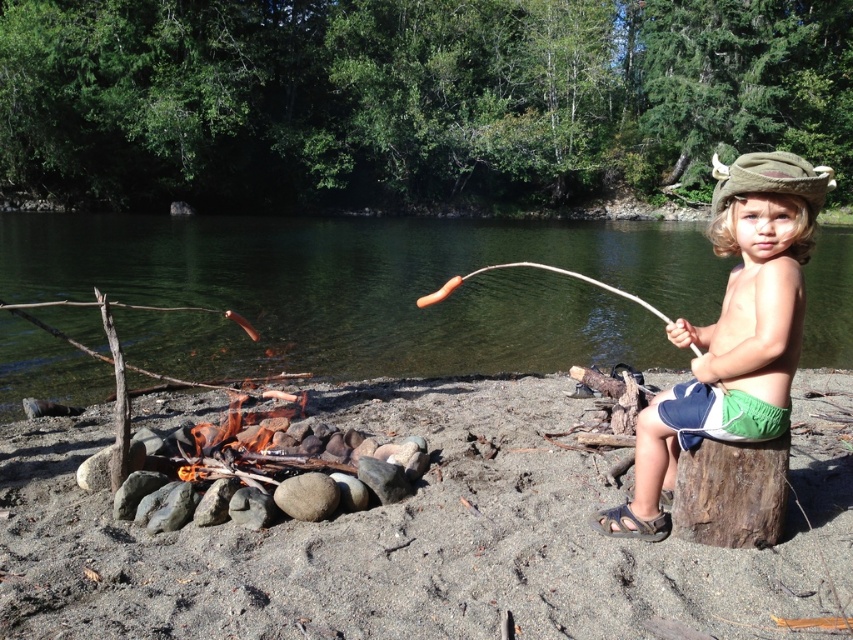
You are standing at the edge of the riverbank and want to reach the brown rough tree trunk at lower right without getting your feet wet. Based on the scene, which direction should you move to avoid stepping into the green water at center?

You should move towards the right side of the image because the brown rough tree trunk at lower right is farther from the viewer compared to the green water at center, so moving right would take you away from the water towards the tree trunk.

Looking at the scene by the riverbank, you notice the green water at center and the green fabric hat at right. Which object is wider?

The green water at center is wider than the green fabric hat at right.

You are standing at the riverbank and want to retrieve a floating item located at the green water at center. Considering your height is 1.6 meters, can you reach it without wading into the water?

The green water at center is 2.94 meters away from the viewer. Since your height is 1.6 meters, you cannot reach it without wading into the water.